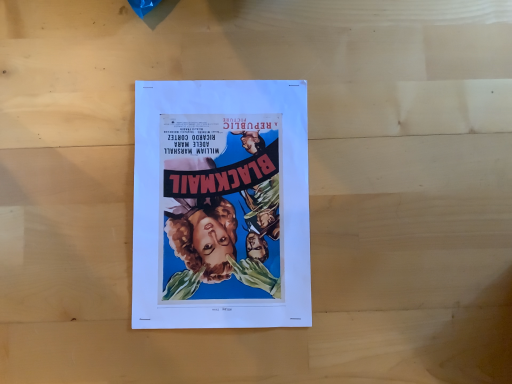
Identify the location of matte paper poster at center. This screenshot has width=512, height=384. (221, 205).

Image resolution: width=512 pixels, height=384 pixels. Describe the element at coordinates (221, 205) in the screenshot. I see `matte paper poster at center` at that location.

You are a GUI agent. You are given a task and a screenshot of the screen. Output one action in this format:
    pyautogui.click(x=<x>, y=<y>)
    Task: Click on the matte paper poster at center
    
    Given the screenshot: What is the action you would take?
    pyautogui.click(x=221, y=205)